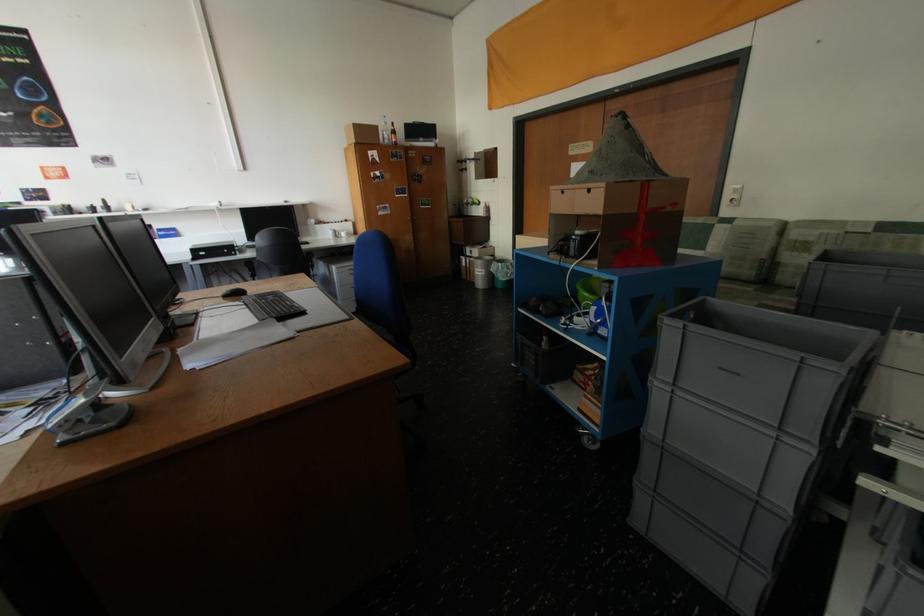
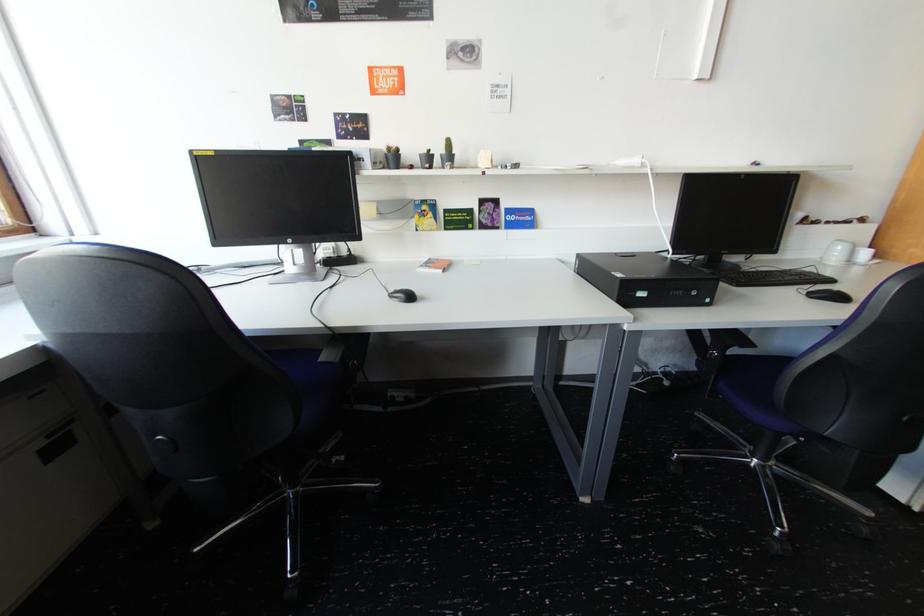
The point at (211, 254) is marked in the first image. Where is the corresponding point in the second image?

(650, 294)